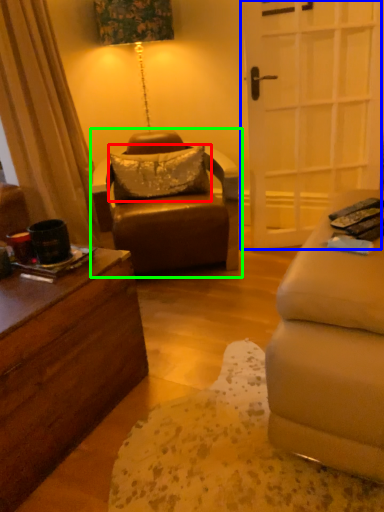
Question: Considering the real-world distances, which object is farthest from pillow (highlighted by a red box)? door (highlighted by a blue box) or chair (highlighted by a green box)?

Choices:
 (A) door
 (B) chair

Answer: (A)